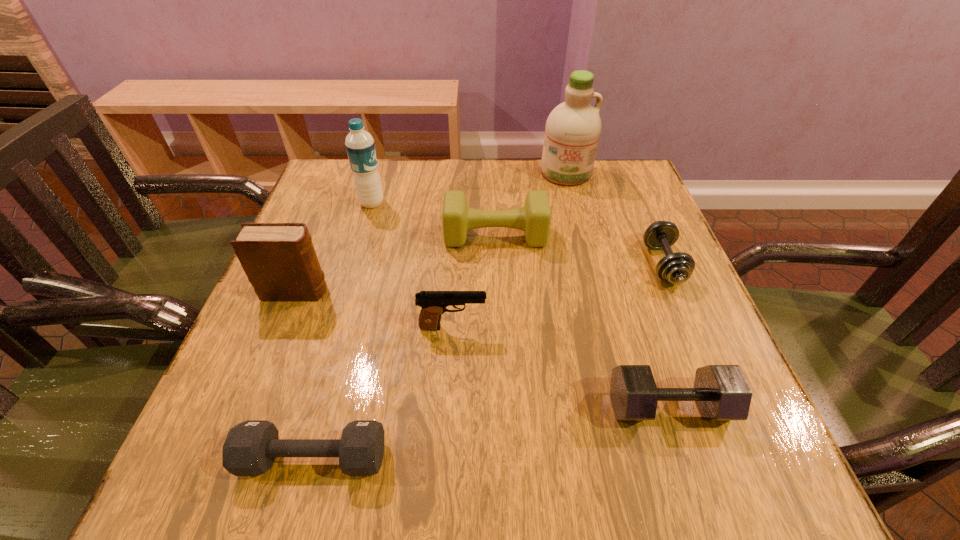
The image size is (960, 540). What are the coordinates of `blank space located 0.220m on the front label of the cleansing agent` in the screenshot? It's located at (584, 241).

Find the location of a particular element. The height and width of the screenshot is (540, 960). vacant space located 0.070m on the label of the water bottle is located at coordinates (413, 203).

What are the coordinates of `vacant position located 0.140m on the spine side of the diary` in the screenshot? It's located at [396, 292].

Identify the location of vacant space located on the front of the second dumbbell from left to right. (500, 349).

Identify the location of free spot located 0.230m at the barrel of the pistol. The width and height of the screenshot is (960, 540). (608, 327).

The image size is (960, 540). I want to click on vacant position located on the left of the seventh farthest object, so click(582, 407).

This screenshot has height=540, width=960. What are the coordinates of `vacant area situated on the back of the nearest dumbbell` in the screenshot? It's located at (360, 283).

Identify the location of cleansing agent present at the far edge. (573, 128).

Where is `water bottle situated at the far edge`? water bottle situated at the far edge is located at coordinates (360, 146).

The height and width of the screenshot is (540, 960). Find the location of `object at the near edge`. object at the near edge is located at coordinates (250, 448).